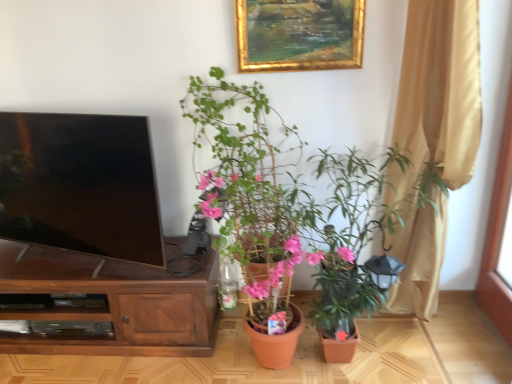
Question: Is beige fabric curtain at right bigger or smaller than matte terracotta pot at center, marked as the 2th houseplant in a right-to-left arrangement?

Choices:
 (A) big
 (B) small

Answer: (B)

Question: From the image's perspective, is beige fabric curtain at right located above or below matte terracotta pot at center, marked as the 2th houseplant in a right-to-left arrangement?

Choices:
 (A) below
 (B) above

Answer: (B)

Question: Which of these objects is positioned closest to the beige fabric curtain at right?

Choices:
 (A) gold/gilded picture frame at upper center
 (B) matte terracotta pot at center, marked as the 2th houseplant in a right-to-left arrangement
 (C) green matte plant at lower right, acting as the second houseplant starting from the left
 (D) matte black tv at left
 (E) brown wood cabinet at left

Answer: (C)

Question: Which object is positioned closest to the brown wood cabinet at left?

Choices:
 (A) matte terracotta pot at center, marked as the 2th houseplant in a right-to-left arrangement
 (B) matte black tv at left
 (C) gold/gilded picture frame at upper center
 (D) green matte plant at lower right, marked as the 1th houseplant in a right-to-left arrangement
 (E) beige fabric curtain at right

Answer: (B)